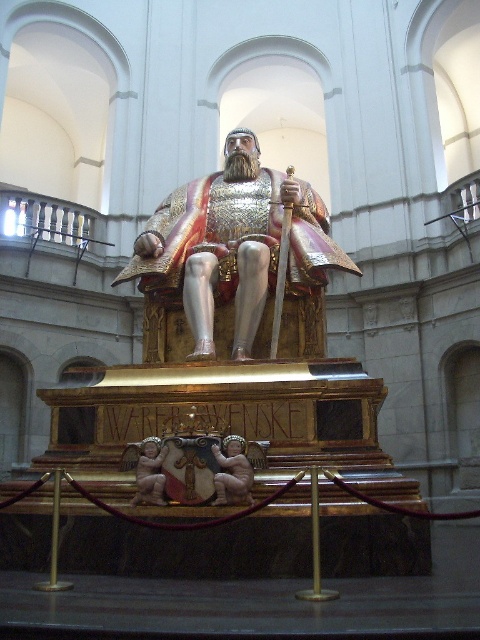
Question: Is polished bronze cherub at center positioned behind matte gold cherub at center?

Choices:
 (A) no
 (B) yes

Answer: (A)

Question: Is shiny gold armor at center bigger than matte gold cherub at center?

Choices:
 (A) no
 (B) yes

Answer: (B)

Question: Can you confirm if shiny gold armor at center is thinner than matte gold cherub at center?

Choices:
 (A) no
 (B) yes

Answer: (A)

Question: Based on their relative distances, which object is farther from the matte gold cherub at center?

Choices:
 (A) shiny gold armor at center
 (B) polished bronze cherub at center

Answer: (A)

Question: Which point is closer to the camera?

Choices:
 (A) polished bronze cherub at center
 (B) matte gold cherub at center

Answer: (A)

Question: Based on their relative distances, which object is nearer to the shiny gold armor at center?

Choices:
 (A) matte gold cherub at center
 (B) polished bronze cherub at center

Answer: (B)